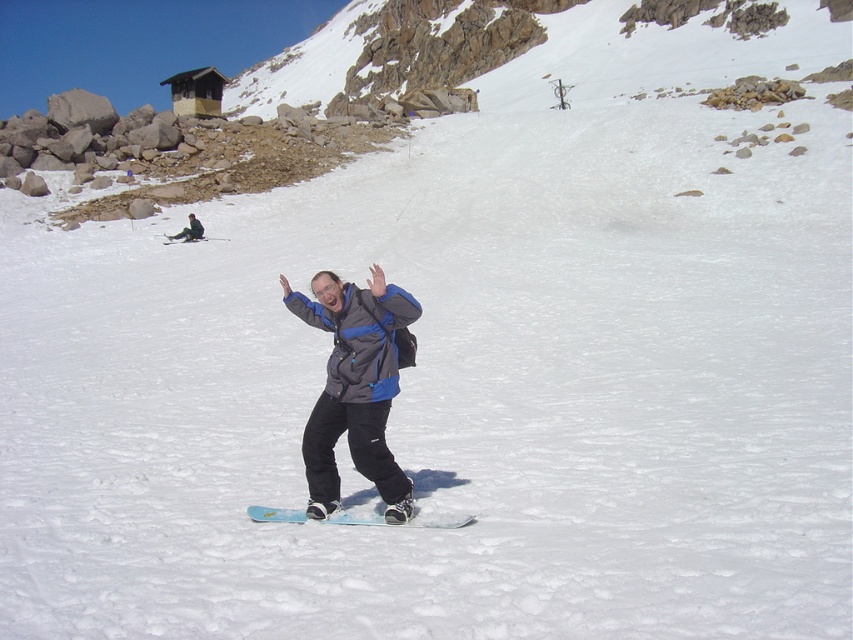
You are standing at the bottom of the slope and want to reach the blue matte snowboard at center which is on the slope. Considering the snowboard is 8.73 meters away, can you walk straight to it without any obstacles?

The blue matte snowboard at center is 8.73 meters away from the viewer. Since there are no mentioned obstacles in the scene description, you can walk straight to it.

You are a snowboarder who wants to place your blue plastic snowboard at center next to your blue matte snowboard at center. Can you fit both snowboards side by side in a space that is 35 inches wide?

The distance between the blue matte snowboard at center and the blue plastic snowboard at center is 34.19 inches. Since 34.19 inches is less than 35 inches, both snowboards can fit side by side in the 35 inch wide space.